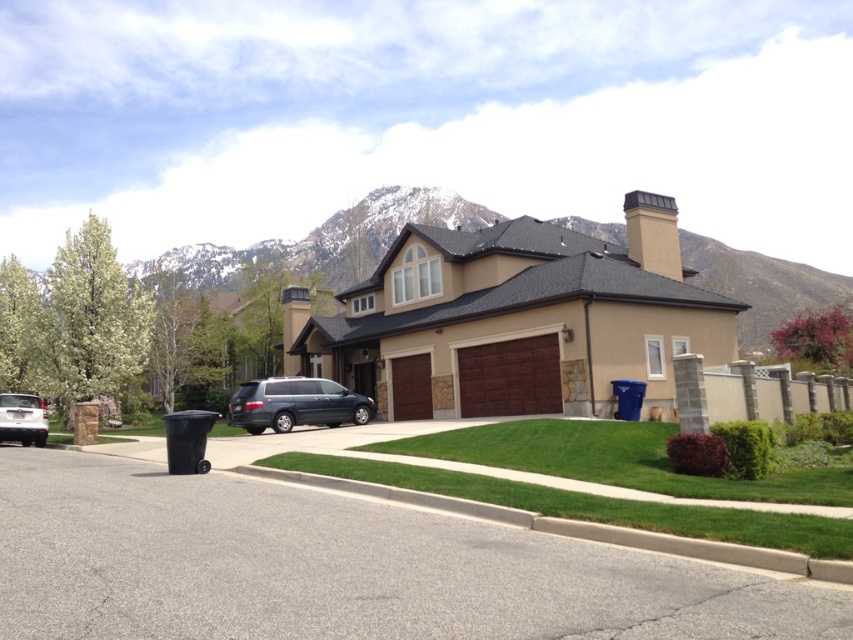
Question: Which object is positioned farthest from the white matte van at lower left?

Choices:
 (A) gray asphalt driveway at center
 (B) satin dark blue minivan at center
 (C) snowy rock at upper center
 (D) brown wood/glass garage at center

Answer: (C)

Question: Can you confirm if gray asphalt driveway at center is positioned to the right of satin dark blue minivan at center?

Choices:
 (A) no
 (B) yes

Answer: (B)

Question: Which object is closer to the camera taking this photo?

Choices:
 (A) brown wood/glass garage at center
 (B) satin dark blue minivan at center

Answer: (A)

Question: From the image, what is the correct spatial relationship of brown wood/glass garage at center in relation to white matte van at lower left?

Choices:
 (A) below
 (B) above

Answer: (B)

Question: Among these objects, which one is nearest to the camera?

Choices:
 (A) brown wood/glass garage at center
 (B) satin dark blue minivan at center
 (C) snowy rock at upper center

Answer: (A)

Question: Considering the relative positions of gray asphalt driveway at center and snowy rock at upper center in the image provided, where is gray asphalt driveway at center located with respect to snowy rock at upper center?

Choices:
 (A) below
 (B) above

Answer: (A)